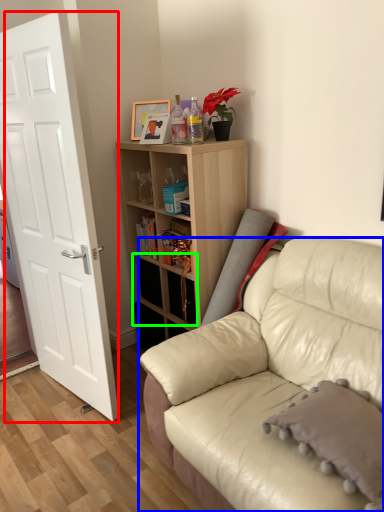
Question: Estimate the real-world distances between objects in this image. Which object is closer to door (highlighted by a red box), studio couch (highlighted by a blue box) or drawer (highlighted by a green box)?

Choices:
 (A) studio couch
 (B) drawer

Answer: (B)